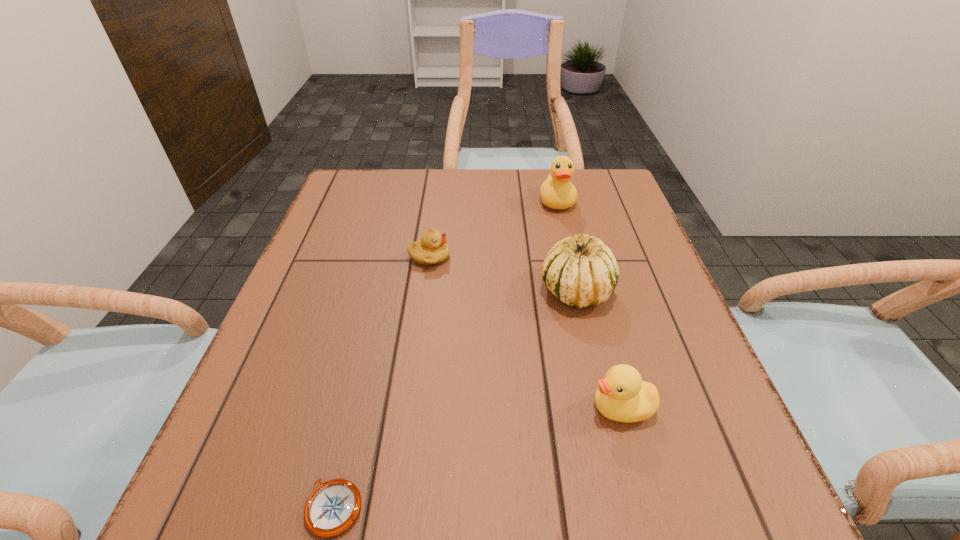
Where is `vacant space situated at the beak of the nearer duck`? This screenshot has width=960, height=540. vacant space situated at the beak of the nearer duck is located at coordinates (520, 407).

Image resolution: width=960 pixels, height=540 pixels. Find the location of `free region located 0.350m at the beak of the nearer duck`. free region located 0.350m at the beak of the nearer duck is located at coordinates (372, 407).

At what (x,y) coordinates should I click in order to perform the action: click on vacant space located at the beak of the nearer duck. Please return your answer as a coordinate pair (x, y). Looking at the image, I should click on (366, 407).

You are a GUI agent. You are given a task and a screenshot of the screen. Output one action in this format:
    pyautogui.click(x=<x>, y=<y>)
    Task: Click on the vacant space located 0.240m at the beak of the duckling
    Image resolution: width=960 pixels, height=540 pixels.
    Given the screenshot: What is the action you would take?
    pyautogui.click(x=557, y=258)

Locate an element on the screen. This screenshot has width=960, height=540. blank area located 0.260m on the right of the shortest object is located at coordinates (555, 508).

Identify the location of object that is positioned at the far edge. This screenshot has width=960, height=540. (557, 192).

Locate an element on the screen. The height and width of the screenshot is (540, 960). object that is at the near edge is located at coordinates (331, 509).

You are a GUI agent. You are given a task and a screenshot of the screen. Output one action in this format:
    pyautogui.click(x=<x>, y=<y>)
    Task: Click on the object at the left edge
    This screenshot has width=960, height=540.
    Given the screenshot: What is the action you would take?
    pyautogui.click(x=331, y=509)

The width and height of the screenshot is (960, 540). What are the coordinates of `gourd that is at the right edge` in the screenshot? It's located at (581, 271).

Find the location of `object that is at the near left corner`. object that is at the near left corner is located at coordinates (331, 509).